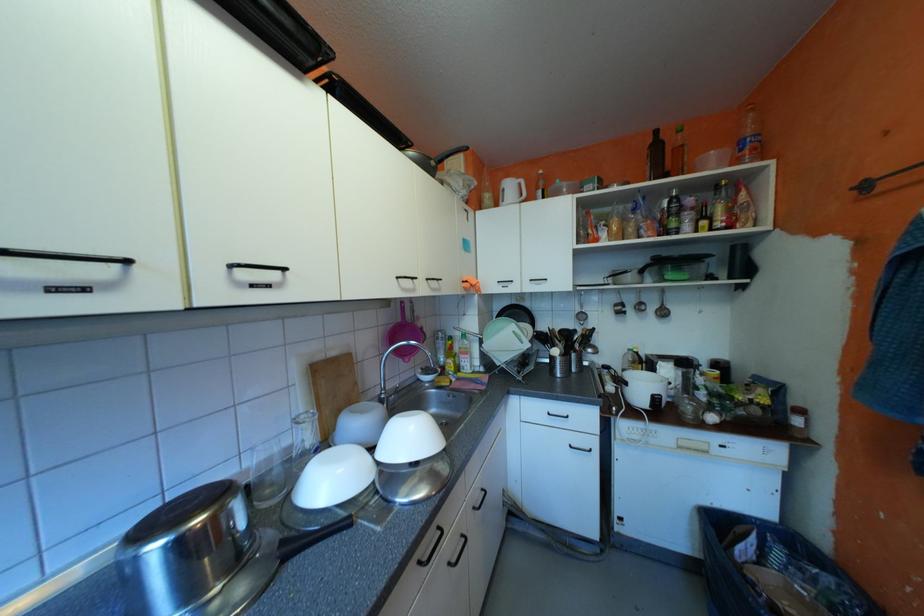
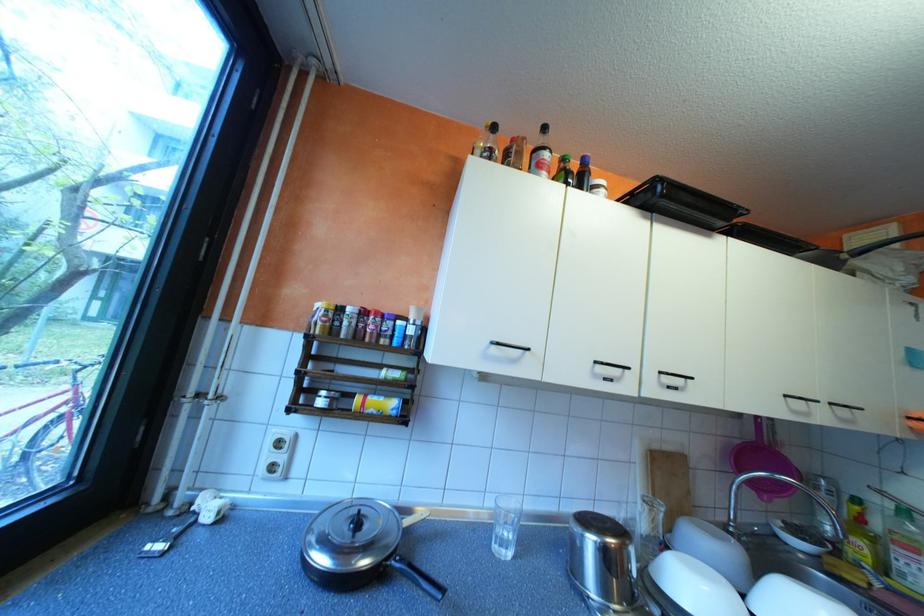
Locate, in the second image, the point that corresponds to the point at 342,480 in the first image.

(709, 592)